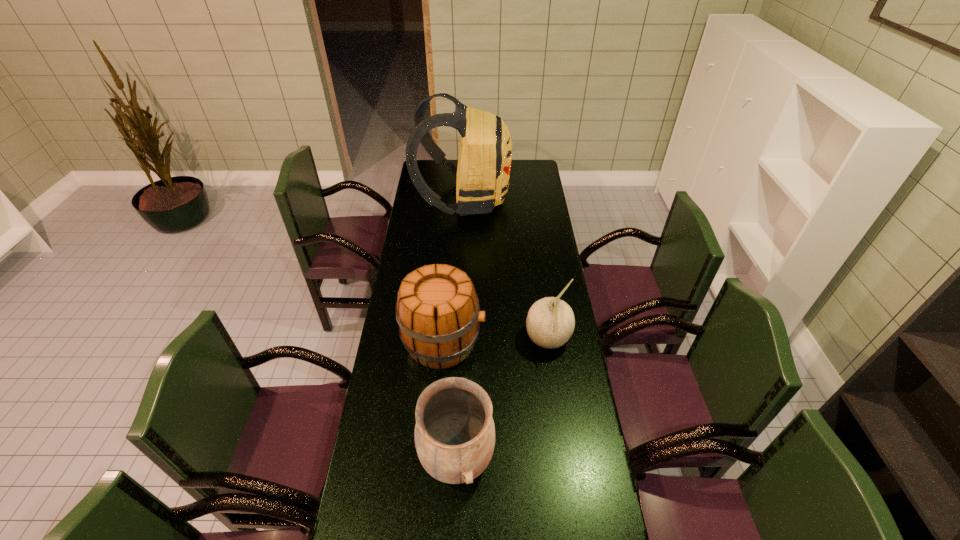
Locate an element on the screen. This screenshot has height=540, width=960. free spot between the cantaloup and the nearest object is located at coordinates (502, 399).

The height and width of the screenshot is (540, 960). Find the location of `free space between the cantaloup and the farthest object`. free space between the cantaloup and the farthest object is located at coordinates (506, 270).

Identify which object is the closest to the farthest object. Please provide its 2D coordinates. Your answer should be formatted as a tuple, i.e. [(x, y)], where the tuple contains the x and y coordinates of a point satisfying the conditions above.

[(437, 309)]

Locate which object is the closest to the cantaloup. Please provide its 2D coordinates. Your answer should be formatted as a tuple, i.e. [(x, y)], where the tuple contains the x and y coordinates of a point satisfying the conditions above.

[(437, 309)]

Where is `vacant space that satisfies the following two spatial constraints: 1. on the front-facing side of the backpack; 2. on the right side of the rightmost object`? This screenshot has height=540, width=960. vacant space that satisfies the following two spatial constraints: 1. on the front-facing side of the backpack; 2. on the right side of the rightmost object is located at coordinates (457, 341).

The width and height of the screenshot is (960, 540). Identify the location of vacant area that satisfies the following two spatial constraints: 1. on the front-facing side of the farthest object; 2. on the back side of the urn. (451, 457).

Locate an element on the screen. vacant region that satisfies the following two spatial constraints: 1. on the front-facing side of the farthest object; 2. on the left side of the urn is located at coordinates (451, 457).

Where is `blank area in the image that satisfies the following two spatial constraints: 1. on the front-facing side of the backpack; 2. on the back side of the urn`? The height and width of the screenshot is (540, 960). blank area in the image that satisfies the following two spatial constraints: 1. on the front-facing side of the backpack; 2. on the back side of the urn is located at coordinates (451, 457).

At what (x,y) coordinates should I click in order to perform the action: click on vacant space that satisfies the following two spatial constraints: 1. on the front side of the rightmost object; 2. on the side of the cider where the spigot is located. Please return your answer as a coordinate pair (x, y). The height and width of the screenshot is (540, 960). Looking at the image, I should click on (548, 342).